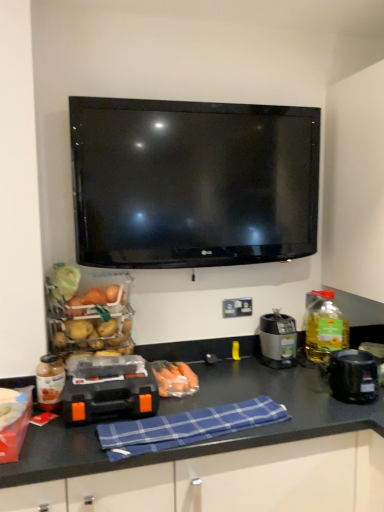
Locate an element on the screen. The image size is (384, 512). free space above orange plastic toolbox at center, which is the first appliance in left-to-right order (from a real-world perspective) is located at coordinates (104, 381).